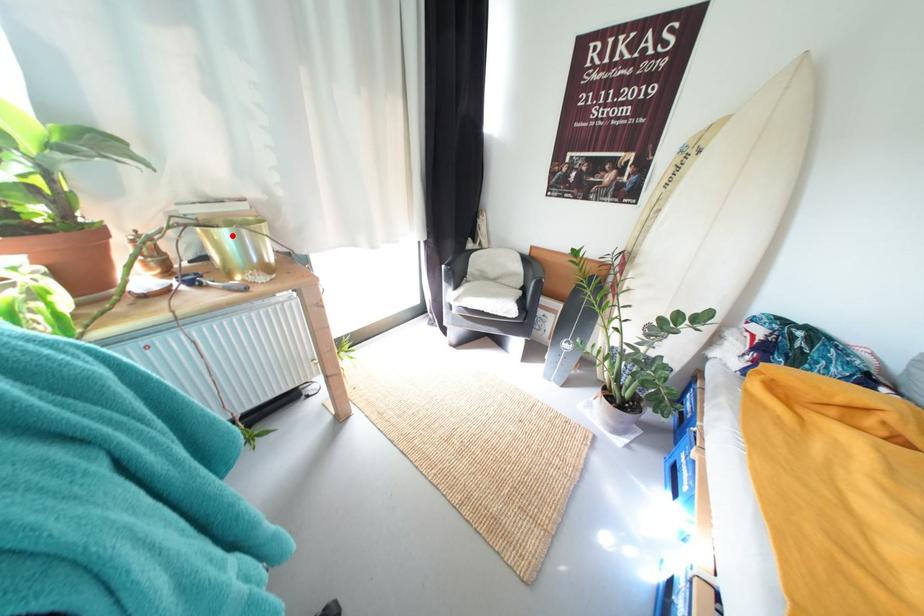
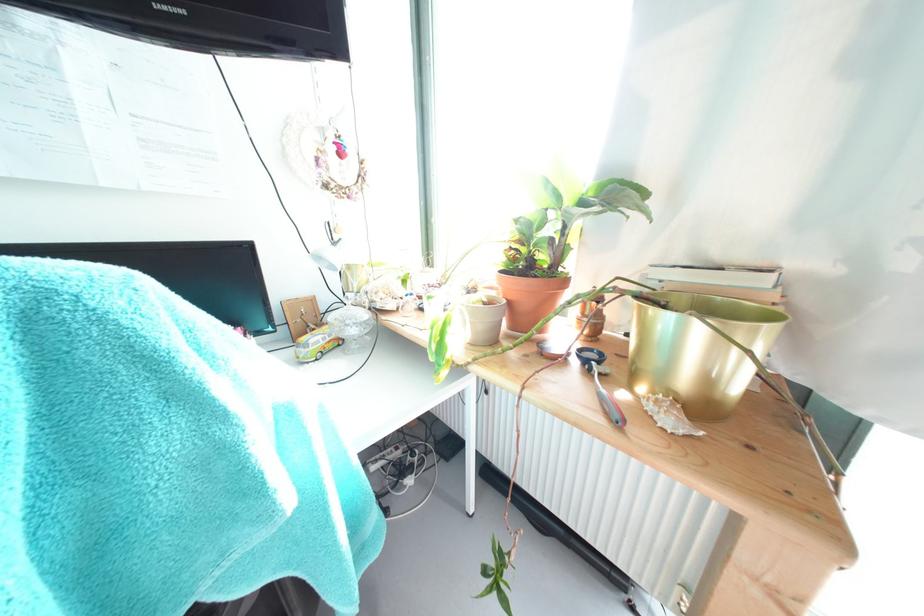
The point at the highlighted location is marked in the first image. Where is the corresponding point in the second image?

(675, 321)